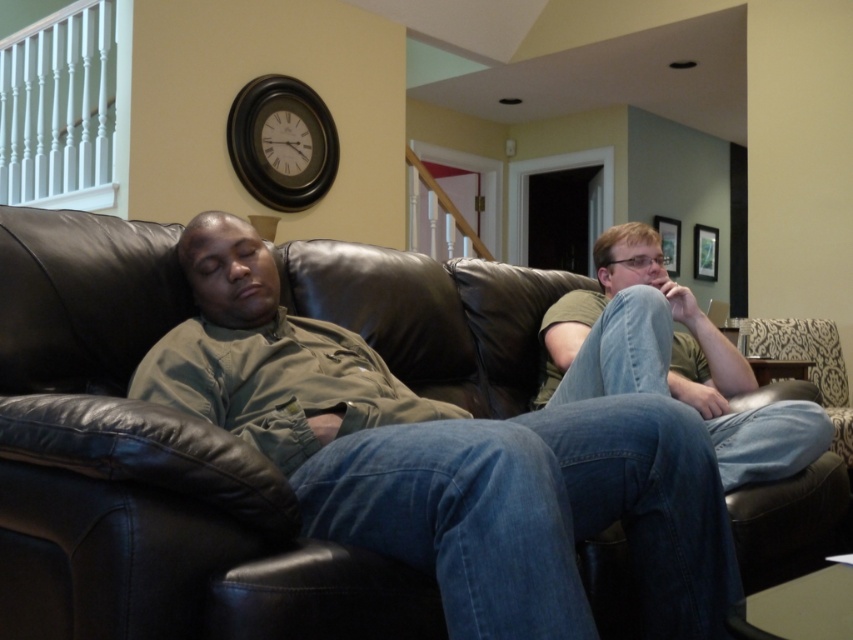
Question: Which point is farther to the camera?

Choices:
 (A) black leather couch at center
 (B) denim jeans at right

Answer: (A)

Question: Does black leather couch at center have a smaller size compared to denim jeans at right?

Choices:
 (A) no
 (B) yes

Answer: (B)

Question: Among these objects, which one is farthest from the camera?

Choices:
 (A) denim jeans at right
 (B) black leather couch at center

Answer: (B)

Question: Does black leather couch at center come behind denim jeans at right?

Choices:
 (A) yes
 (B) no

Answer: (A)

Question: Which point is closer to the camera taking this photo?

Choices:
 (A) (572, 340)
 (B) (538, 301)

Answer: (A)

Question: Is black leather couch at center to the left of denim jeans at right from the viewer's perspective?

Choices:
 (A) yes
 (B) no

Answer: (A)